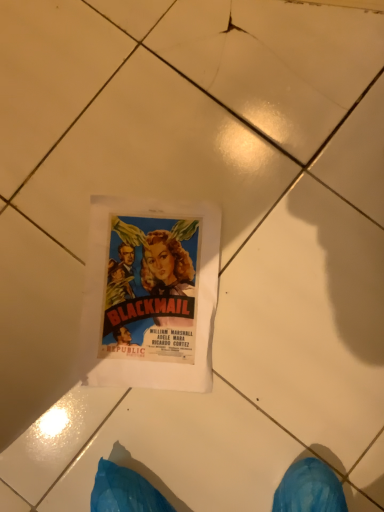
Locate an element on the screen. vacant point above matte paper poster at center (from a real-world perspective) is located at coordinates (150, 293).